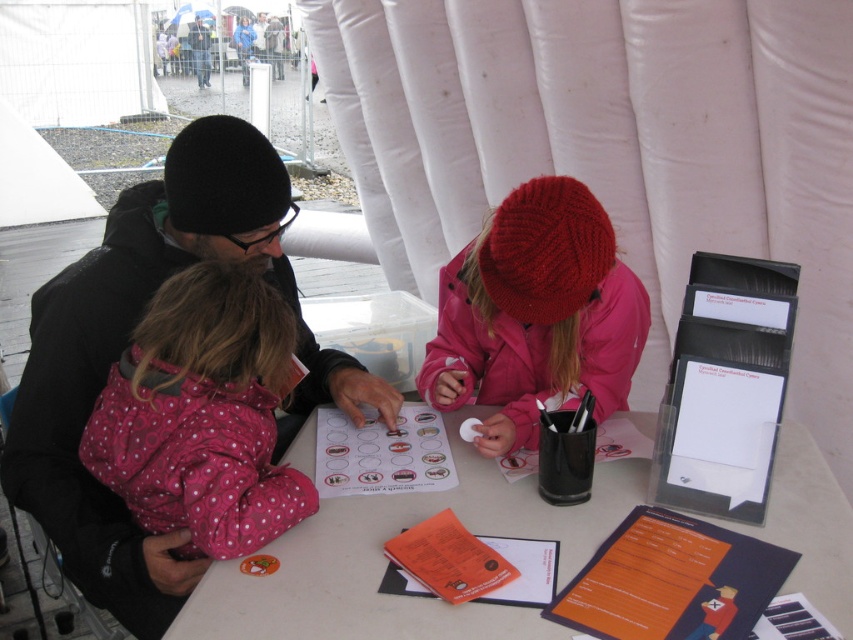
Question: Which object appears closest to the camera in this image?

Choices:
 (A) black knit hat at upper left
 (B) knitted woolen hat at center

Answer: (B)

Question: From the image, what is the correct spatial relationship of pink polka dot jacket at left in relation to knitted woolen hat at center?

Choices:
 (A) left
 (B) right

Answer: (A)

Question: Is pink polka dot jacket at left closer to the viewer compared to knitted woolen hat at center?

Choices:
 (A) yes
 (B) no

Answer: (A)

Question: Which object is the closest to the black knit hat at upper left?

Choices:
 (A) knitted woolen hat at center
 (B) matte black jacket at upper left
 (C) pink polka dot jacket at left

Answer: (C)

Question: Which point is closer to the camera?

Choices:
 (A) coord(57,538)
 (B) coord(200,72)
 (C) coord(490,324)
 (D) coord(782,465)

Answer: (A)

Question: From the image, what is the correct spatial relationship of black knit hat at upper left in relation to knitted woolen hat at center?

Choices:
 (A) left
 (B) right

Answer: (A)